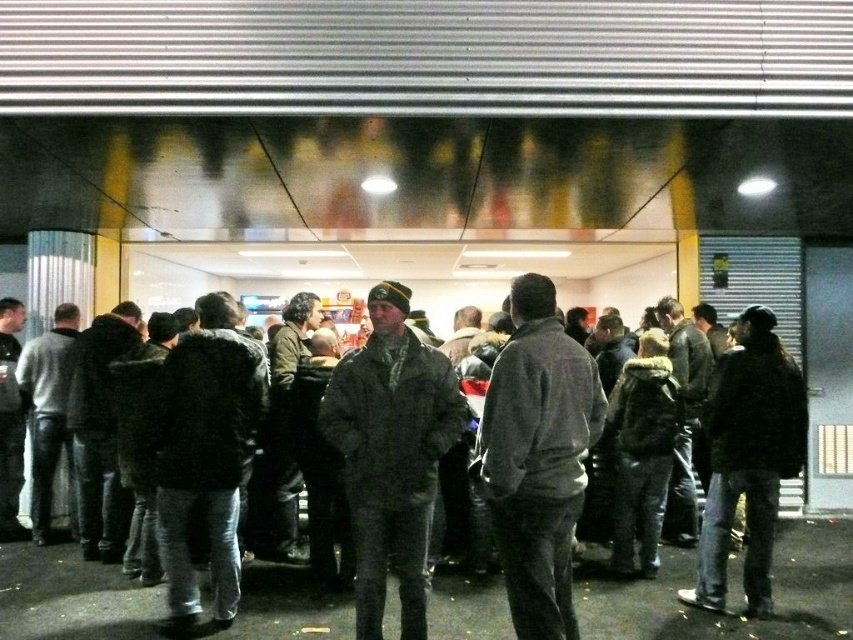
Question: Can you confirm if camouflage jacket at center is positioned below dark brown leather jacket at right?

Choices:
 (A) no
 (B) yes

Answer: (A)

Question: Which of the following is the closest to the observer?

Choices:
 (A) (432, 451)
 (B) (769, 483)
 (C) (566, 419)

Answer: (C)

Question: Can you confirm if dark gray jacket at center is thinner than dark brown leather jacket at right?

Choices:
 (A) no
 (B) yes

Answer: (B)

Question: Which object is positioned closest to the dark gray jacket at center?

Choices:
 (A) camouflage jacket at center
 (B) dark brown leather jacket at right

Answer: (A)

Question: Is dark gray jacket at center further to the viewer compared to dark brown leather jacket at right?

Choices:
 (A) no
 (B) yes

Answer: (A)

Question: Which object is positioned closest to the camouflage jacket at center?

Choices:
 (A) dark gray jacket at center
 (B) dark brown leather jacket at right

Answer: (A)